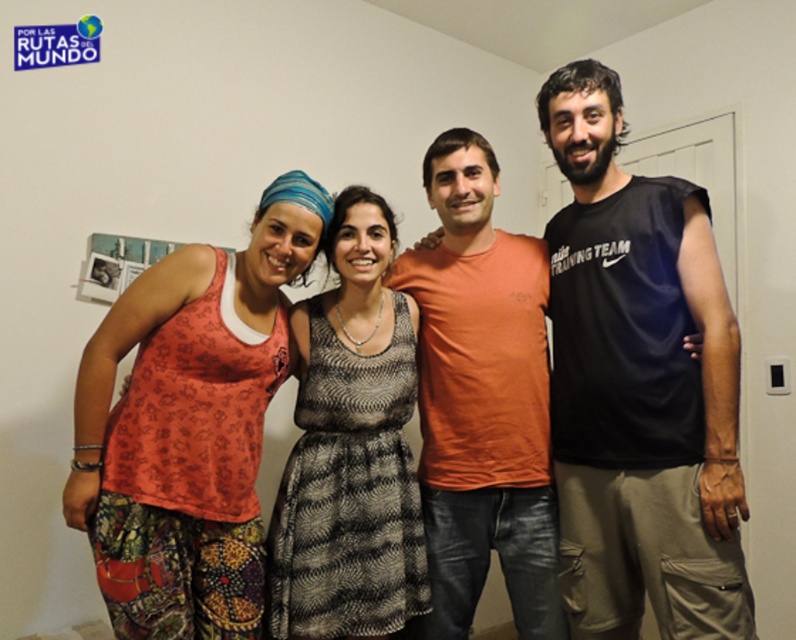
Is matte black tank top at center bigger than patterned fabric dress at center?

Yes, matte black tank top at center is bigger than patterned fabric dress at center.

Does matte black tank top at center have a greater height compared to patterned fabric dress at center?

Indeed, matte black tank top at center has a greater height compared to patterned fabric dress at center.

The image size is (796, 640). Find the location of `matte black tank top at center`. matte black tank top at center is located at coordinates (482, 400).

Where is `matte black tank top at center`? matte black tank top at center is located at coordinates (482, 400).

Who is positioned more to the left, black sleeveless shirt at right or patterned fabric dress at center?

patterned fabric dress at center is more to the left.

Is point (724, 390) positioned in front of point (299, 456)?

That is True.

Is point (574, 237) closer to camera compared to point (356, 252)?

No, it is behind (356, 252).

I want to click on black sleeveless shirt at right, so click(x=638, y=387).

Who is lower down, black sleeveless shirt at right or printed cotton tank top at left?

printed cotton tank top at left is lower down.

Between point (623, 230) and point (181, 304), which one is positioned in front?

Point (181, 304) is more forward.

Who is more forward, (646, 248) or (256, 285)?

Positioned in front is point (646, 248).

At what (x,y) coordinates should I click in order to perform the action: click on black sleeveless shirt at right. Please return your answer as a coordinate pair (x, y). Looking at the image, I should click on (638, 387).